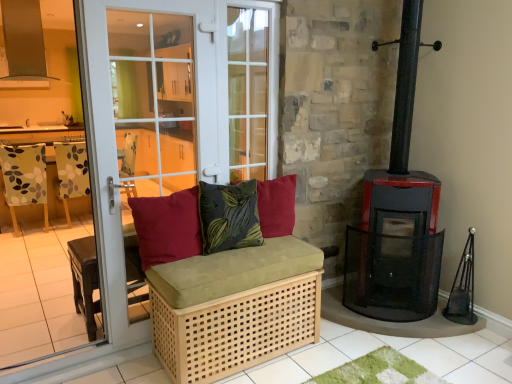
Question: Is velvet green pillow at center, which is the 2th pillow from left to right, outside of black metal wood burning stove at right?

Choices:
 (A) no
 (B) yes

Answer: (B)

Question: Is the depth of velvet green pillow at center, the 2th pillow positioned from the right, less than that of black metal wood burning stove at right?

Choices:
 (A) no
 (B) yes

Answer: (B)

Question: Considering the relative sizes of velvet green pillow at center, the 2th pillow positioned from the right, and black metal wood burning stove at right in the image provided, is velvet green pillow at center, the 2th pillow positioned from the right, thinner than black metal wood burning stove at right?

Choices:
 (A) no
 (B) yes

Answer: (B)

Question: Can you confirm if velvet green pillow at center, the 2th pillow positioned from the right, is shorter than black metal wood burning stove at right?

Choices:
 (A) yes
 (B) no

Answer: (A)

Question: Does velvet green pillow at center, which is the 2th pillow from left to right, have a greater width compared to black metal wood burning stove at right?

Choices:
 (A) yes
 (B) no

Answer: (B)

Question: In terms of size, does velvet green pillow at center, the 2th pillow positioned from the right, appear bigger or smaller than velvet red cushion at center, which appears as the first pillow when viewed from the right?

Choices:
 (A) small
 (B) big

Answer: (B)

Question: Choose the correct answer: Is velvet green pillow at center, which is the 2th pillow from left to right, inside velvet red cushion at center, which appears as the first pillow when viewed from the right, or outside it?

Choices:
 (A) outside
 (B) inside

Answer: (A)

Question: Is velvet green pillow at center, the 2th pillow positioned from the right, taller or shorter than velvet red cushion at center, the third pillow from the left?

Choices:
 (A) short
 (B) tall

Answer: (B)

Question: Is point (236, 185) positioned closer to the camera than point (274, 203)?

Choices:
 (A) farther
 (B) closer

Answer: (B)

Question: Considering the positions of white glass door at left and patterned fabric armchair at left in the image, is white glass door at left wider or thinner than patterned fabric armchair at left?

Choices:
 (A) wide
 (B) thin

Answer: (B)

Question: Considering the positions of white glass door at left and patterned fabric armchair at left in the image, is white glass door at left bigger or smaller than patterned fabric armchair at left?

Choices:
 (A) small
 (B) big

Answer: (B)

Question: Is point (102, 31) closer or farther from the camera than point (74, 195)?

Choices:
 (A) farther
 (B) closer

Answer: (B)

Question: Which is correct: white glass door at left is inside patterned fabric armchair at left, or outside of it?

Choices:
 (A) outside
 (B) inside

Answer: (A)

Question: Is natural wood woven basket at lower center inside the boundaries of black metal wood burning stove at right, or outside?

Choices:
 (A) outside
 (B) inside

Answer: (A)

Question: Is natural wood woven basket at lower center bigger or smaller than black metal wood burning stove at right?

Choices:
 (A) small
 (B) big

Answer: (B)